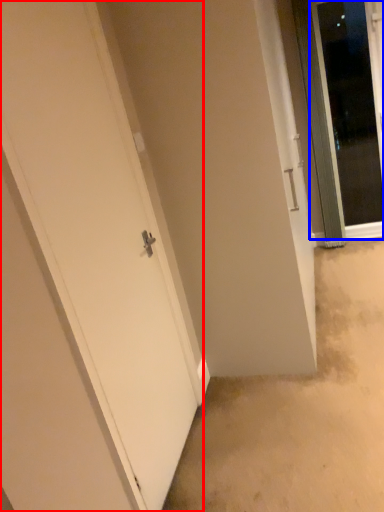
Question: Which of the following is the closest to the observer, door (highlighted by a red box) or door (highlighted by a blue box)?

Choices:
 (A) door
 (B) door

Answer: (A)